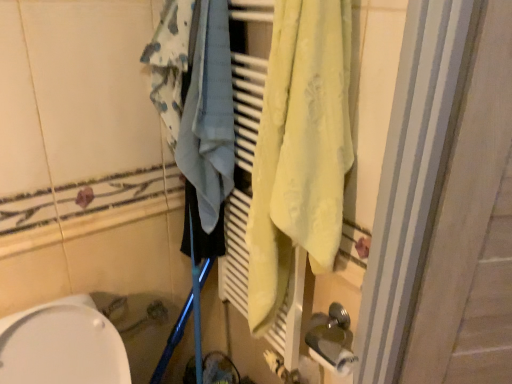
Question: Does light blue fabric at center have a lesser height compared to white matte toilet paper at lower right?

Choices:
 (A) yes
 (B) no

Answer: (B)

Question: From the image's perspective, does light blue fabric at center appear higher than white matte toilet paper at lower right?

Choices:
 (A) yes
 (B) no

Answer: (A)

Question: Does light blue fabric at center touch white matte toilet paper at lower right?

Choices:
 (A) no
 (B) yes

Answer: (A)

Question: Is light blue fabric at center taller than white matte toilet paper at lower right?

Choices:
 (A) no
 (B) yes

Answer: (B)

Question: From a real-world perspective, is light blue fabric at center physically above white matte toilet paper at lower right?

Choices:
 (A) yes
 (B) no

Answer: (A)

Question: Looking at their shapes, would you say white matte toilet paper at lower right is wider or thinner than white glossy toilet at lower left?

Choices:
 (A) thin
 (B) wide

Answer: (A)

Question: From their relative heights in the image, would you say white matte toilet paper at lower right is taller or shorter than white glossy toilet at lower left?

Choices:
 (A) tall
 (B) short

Answer: (B)

Question: Based on their sizes in the image, would you say white matte toilet paper at lower right is bigger or smaller than white glossy toilet at lower left?

Choices:
 (A) big
 (B) small

Answer: (B)

Question: Is point (315, 355) positioned closer to the camera than point (42, 336)?

Choices:
 (A) farther
 (B) closer

Answer: (A)

Question: Does point (429, 369) appear closer or farther from the camera than point (16, 329)?

Choices:
 (A) farther
 (B) closer

Answer: (A)

Question: From a real-world perspective, is white striped screen door at right positioned above or below white glossy toilet at lower left?

Choices:
 (A) below
 (B) above

Answer: (B)

Question: From the image's perspective, is white striped screen door at right located above or below white glossy toilet at lower left?

Choices:
 (A) below
 (B) above

Answer: (B)

Question: Is white striped screen door at right situated inside white glossy toilet at lower left or outside?

Choices:
 (A) outside
 (B) inside

Answer: (A)

Question: Considering the positions of white matte toilet paper at lower right and light blue fabric at center in the image, is white matte toilet paper at lower right taller or shorter than light blue fabric at center?

Choices:
 (A) short
 (B) tall

Answer: (A)

Question: Looking at the image, does white matte toilet paper at lower right seem bigger or smaller compared to light blue fabric at center?

Choices:
 (A) big
 (B) small

Answer: (B)